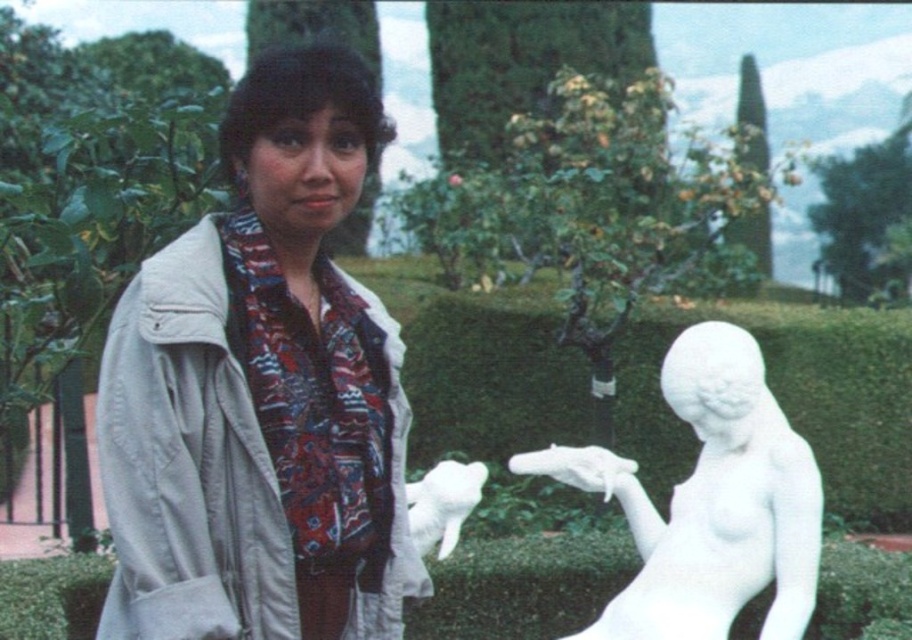
Can you confirm if white matte jacket at upper left is positioned above white glossy statue at center?

Correct, white matte jacket at upper left is located above white glossy statue at center.

Can you confirm if white matte jacket at upper left is smaller than white glossy statue at center?

Yes.

At what (x,y) coordinates should I click in order to perform the action: click on white matte jacket at upper left. Please return your answer as a coordinate pair (x, y). The image size is (912, 640). Looking at the image, I should click on (261, 392).

The image size is (912, 640). What do you see at coordinates (261, 392) in the screenshot? I see `white matte jacket at upper left` at bounding box center [261, 392].

Does white matte jacket at upper left have a lesser width compared to white marble statue at right?

Yes.

Is point (211, 323) closer to camera compared to point (772, 412)?

Yes.

Where is `white matte jacket at upper left`? Image resolution: width=912 pixels, height=640 pixels. white matte jacket at upper left is located at coordinates (261, 392).

Does white glossy statue at center appear on the left side of white marble statue at right?

No, white glossy statue at center is not to the left of white marble statue at right.

Does white glossy statue at center have a greater width compared to white marble statue at right?

Correct, the width of white glossy statue at center exceeds that of white marble statue at right.

Is point (672, 435) positioned after point (670, 614)?

Yes, point (672, 435) is behind point (670, 614).

I want to click on white glossy statue at center, so click(791, 401).